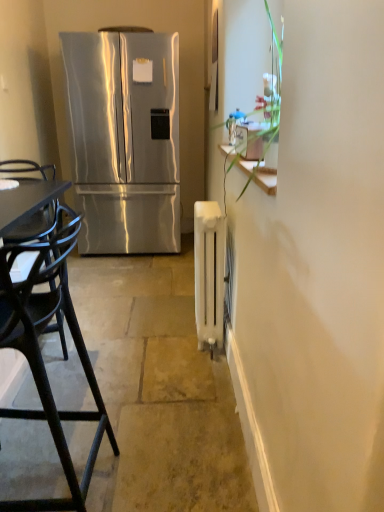
What do you see at coordinates (126, 29) in the screenshot?
I see `satin silver exhaust hood at upper center` at bounding box center [126, 29].

Find the location of `white matte radiator at right`. white matte radiator at right is located at coordinates (158, 390).

Where is `satin silver exhaust hood at upper center`? Image resolution: width=384 pixels, height=512 pixels. satin silver exhaust hood at upper center is located at coordinates (126, 29).

Where is `radiator above the black plastic chair at left (from the image's perspective)`? This screenshot has height=512, width=384. radiator above the black plastic chair at left (from the image's perspective) is located at coordinates (209, 273).

Can you tell me how much white matte radiator at center and black plastic chair at left differ in facing direction?

They differ by 2.89 degrees in their facing directions.

Based on the photo, is white matte radiator at center to the left or to the right of black plastic chair at left in the image?

white matte radiator at center is positioned on black plastic chair at left's right side.

Between point (216, 247) and point (63, 234), which one is positioned behind?

The point (63, 234) is behind.

The image size is (384, 512). Identify the location of radiator on the right of white matte radiator at right. (209, 273).

Is white matte radiator at right smaller than white matte radiator at center?

Incorrect, white matte radiator at right is not smaller in size than white matte radiator at center.

Considering their positions, is white matte radiator at right located in front of or behind white matte radiator at center?

Clearly, white matte radiator at right is in front of white matte radiator at center.

Which of these two, white matte radiator at right or white matte radiator at center, stands shorter?

Standing shorter between the two is white matte radiator at right.

Which object is wider, white matte radiator at center or white matte radiator at right?

Wider between the two is white matte radiator at right.

Which object is positioned more to the left, white matte radiator at center or white matte radiator at right?

white matte radiator at right is more to the left.

Considering the sizes of objects white matte radiator at center and white matte radiator at right in the image provided, who is shorter, white matte radiator at center or white matte radiator at right?

white matte radiator at right is shorter.

Is white matte radiator at center positioned beyond the bounds of white matte radiator at right?

Yes.

Based on their positions, is satin silver exhaust hood at upper center located to the left or right of stainless steel refrigerator at left?

Clearly, satin silver exhaust hood at upper center is on the right of stainless steel refrigerator at left in the image.

Would you say satin silver exhaust hood at upper center is a long distance from stainless steel refrigerator at left?

satin silver exhaust hood at upper center is near stainless steel refrigerator at left, not far away.

Consider the image. How many degrees apart are the facing directions of satin silver exhaust hood at upper center and stainless steel refrigerator at left?

0.00321 degrees.

Is satin silver exhaust hood at upper center closer to camera compared to stainless steel refrigerator at left?

No, satin silver exhaust hood at upper center is behind stainless steel refrigerator at left.

Consider the image. From a real-world perspective, is black plastic chair at left positioned over satin silver exhaust hood at upper center based on gravity?

No, from a real-world perspective, black plastic chair at left is not over satin silver exhaust hood at upper center

Is point (37, 258) closer to viewer compared to point (134, 30)?

Yes, it is.

Image resolution: width=384 pixels, height=512 pixels. In the image, there is a black plastic chair at left. What are the coordinates of `exhaust hood above it (from the image's perspective)` in the screenshot? It's located at (126, 29).

Between black plastic chair at left and satin silver exhaust hood at upper center, which one is positioned behind?

satin silver exhaust hood at upper center is further away from the camera.

From the image's perspective, is white matte radiator at right located above or below black plastic chair at left?

Clearly, from the image's perspective, white matte radiator at right is above black plastic chair at left.

From a real-world perspective, between white matte radiator at right and black plastic chair at left, who is vertically lower?

white matte radiator at right, from a real-world perspective.

Does white matte radiator at right have a lesser height compared to black plastic chair at left?

Correct, white matte radiator at right is not as tall as black plastic chair at left.

From the picture: Which point is more forward, (169, 300) or (44, 250)?

The point (44, 250) is more forward.

Is satin silver exhaust hood at upper center oriented towards white matte radiator at center?

No, satin silver exhaust hood at upper center does not turn towards white matte radiator at center.

Is the surface of satin silver exhaust hood at upper center in direct contact with white matte radiator at center?

No, satin silver exhaust hood at upper center is not next to white matte radiator at center.

From a real-world perspective, is satin silver exhaust hood at upper center positioned above or below white matte radiator at center?

Clearly, from a real-world perspective, satin silver exhaust hood at upper center is above white matte radiator at center.

Between point (105, 29) and point (224, 231), which one is positioned in front?

Point (224, 231)

Identify the location of radiator above the black plastic chair at left (from the image's perspective). The width and height of the screenshot is (384, 512). (209, 273).

You are a GUI agent. You are given a task and a screenshot of the screen. Output one action in this format:
    pyautogui.click(x=<x>, y=<y>)
    Task: Click on the concrete below the white matte radiator at center (from the image's perspective)
    The image size is (384, 512).
    Given the screenshot: What is the action you would take?
    pyautogui.click(x=158, y=390)

When comparing their distances from stainless steel refrigerator at left, does white matte radiator at center or satin silver exhaust hood at upper center seem further?

Based on the image, white matte radiator at center appears to be further to stainless steel refrigerator at left.

Estimate the real-world distances between objects in this image. Which object is closer to white matte radiator at center, white matte radiator at right or black plastic chair at left?

The object closer to white matte radiator at center is white matte radiator at right.

Considering their positions, is black plastic chair at left positioned further to white matte radiator at center than white matte radiator at right?

Among the two, black plastic chair at left is located further to white matte radiator at center.

Consider the image. Based on their spatial positions, is white matte radiator at right or stainless steel refrigerator at left further from white matte radiator at center?

The object further to white matte radiator at center is stainless steel refrigerator at left.

From the image, which object appears to be nearer to stainless steel refrigerator at left, white matte radiator at center or black plastic chair at left?

white matte radiator at center lies closer to stainless steel refrigerator at left than the other object.

Considering their positions, is white matte radiator at center positioned closer to black plastic chair at left than white matte radiator at right?

white matte radiator at right is positioned closer to the anchor black plastic chair at left.

In the scene shown: Looking at the image, which one is located further to satin silver exhaust hood at upper center, white matte radiator at center or black plastic chair at left?

black plastic chair at left is positioned further to the anchor satin silver exhaust hood at upper center.

Estimate the real-world distances between objects in this image. Which object is closer to satin silver exhaust hood at upper center, white matte radiator at right or white matte radiator at center?

The object closer to satin silver exhaust hood at upper center is white matte radiator at center.

This screenshot has width=384, height=512. Identify the location of refrigerator between white matte radiator at right and satin silver exhaust hood at upper center from front to back. (125, 139).

The height and width of the screenshot is (512, 384). I want to click on refrigerator between satin silver exhaust hood at upper center and white matte radiator at center vertically, so click(125, 139).

Identify the location of concrete between black plastic chair at left and stainless steel refrigerator at left from front to back. (158, 390).

You are a GUI agent. You are given a task and a screenshot of the screen. Output one action in this format:
    pyautogui.click(x=<x>, y=<y>)
    Task: Click on the radiator between black plastic chair at left and satin silver exhaust hood at upper center in the front-back direction
    The width and height of the screenshot is (384, 512).
    Given the screenshot: What is the action you would take?
    pyautogui.click(x=209, y=273)